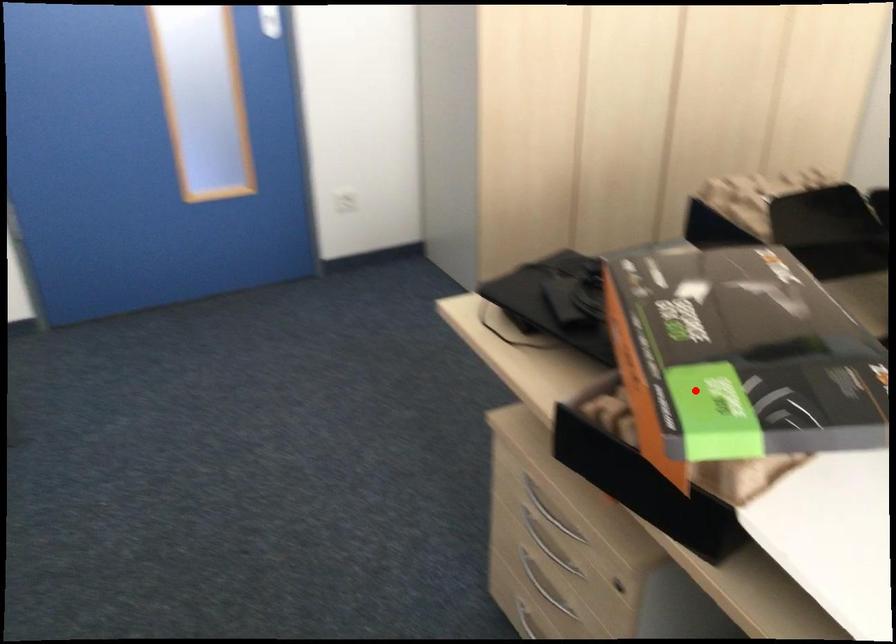
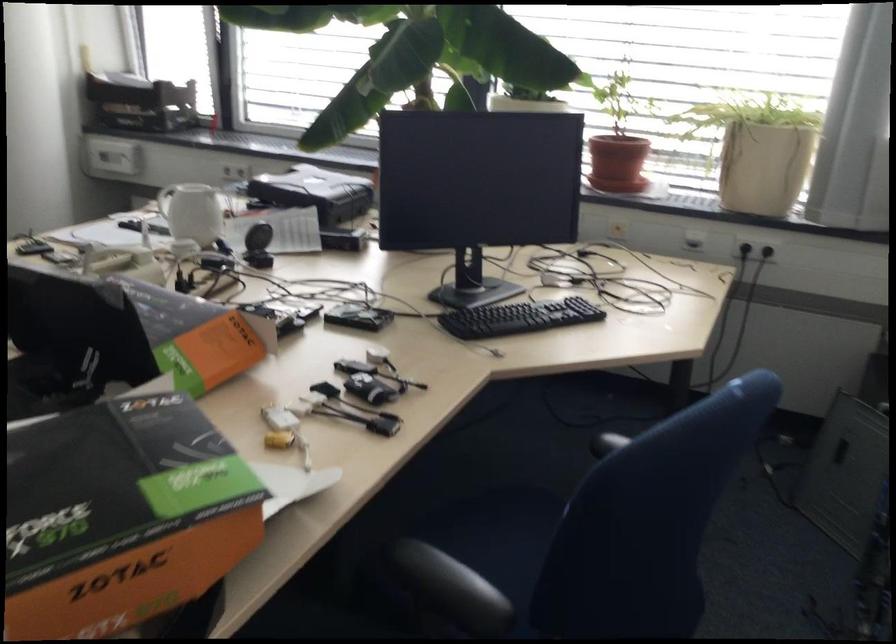
Find the pixel in the second image that matches the highlighted location in the first image.

(121, 516)